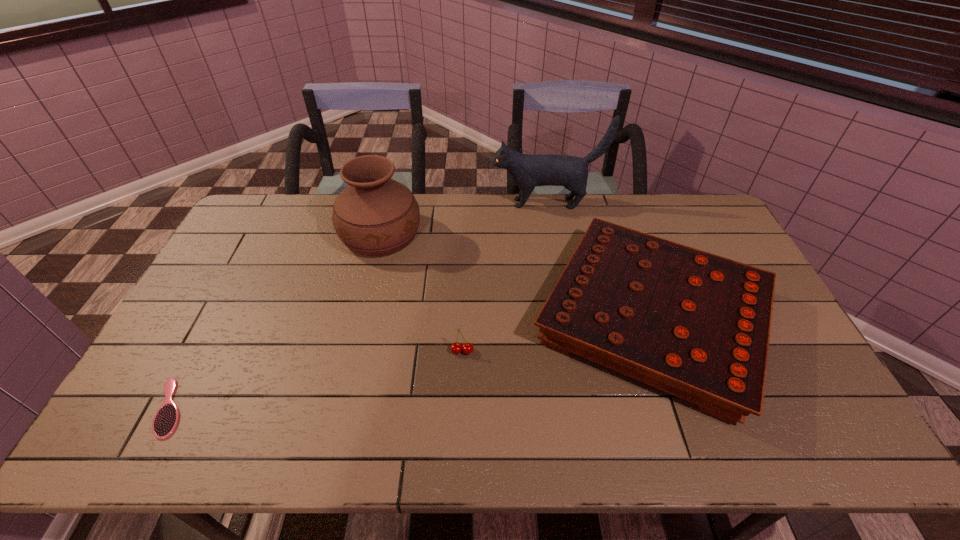
At what (x,y) coordinates should I click in order to perform the action: click on vacant space that is in between the tallest object and the third object from left to right. Please return your answer as a coordinate pair (x, y). The width and height of the screenshot is (960, 540). Looking at the image, I should click on (504, 277).

Find the location of a particular element. The height and width of the screenshot is (540, 960). free spot between the leftmost object and the cherry is located at coordinates (316, 379).

Locate an element on the screen. The width and height of the screenshot is (960, 540). vacant area that lies between the cat and the fourth object from right to left is located at coordinates (464, 219).

Identify which object is the third nearest to the fourth shortest object. Please provide its 2D coordinates. Your answer should be formatted as a tuple, i.e. [(x, y)], where the tuple contains the x and y coordinates of a point satisfying the conditions above.

[(456, 347)]

Identify the location of object that ranks as the closest to the gameboard. (456, 347).

Locate an element on the screen. free point that satisfies the following two spatial constraints: 1. on the back side of the fourth shortest object; 2. on the left side of the hairbrush is located at coordinates (261, 235).

Identify the location of vacant area in the image that satisfies the following two spatial constraints: 1. at the face of the tallest object; 2. on the front side of the fourth shortest object. Image resolution: width=960 pixels, height=540 pixels. (552, 235).

This screenshot has width=960, height=540. In order to click on vacant space that satisfies the following two spatial constraints: 1. at the face of the tallest object; 2. with the stems of the third object from left to right pointing upwards in this screenshot , I will do `click(572, 351)`.

I want to click on free space that satisfies the following two spatial constraints: 1. at the face of the tallest object; 2. with the stems of the fourth tallest object pointing upwards, so click(x=572, y=351).

Locate an element on the screen. This screenshot has width=960, height=540. vacant space that satisfies the following two spatial constraints: 1. on the front side of the fourth object from right to left; 2. on the right side of the third tallest object is located at coordinates (361, 319).